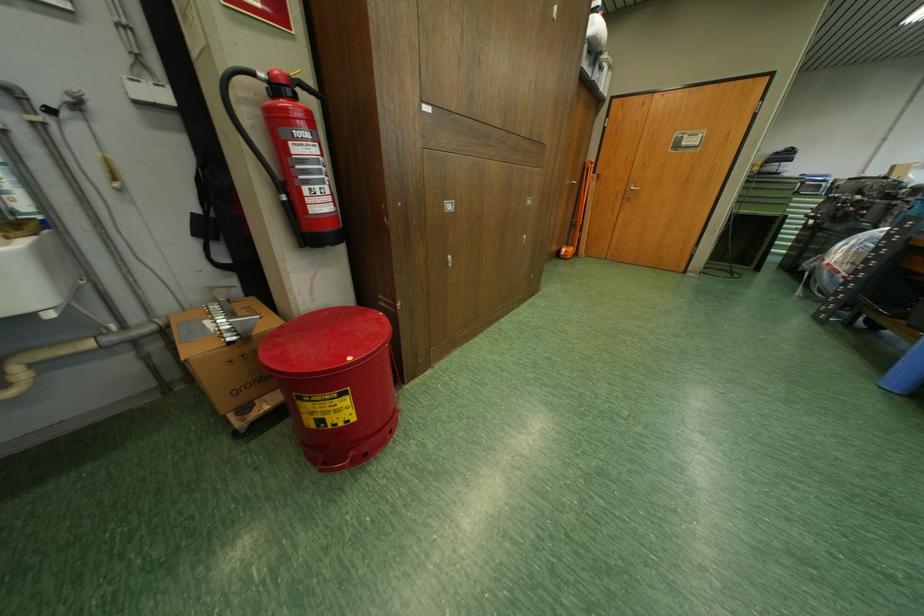
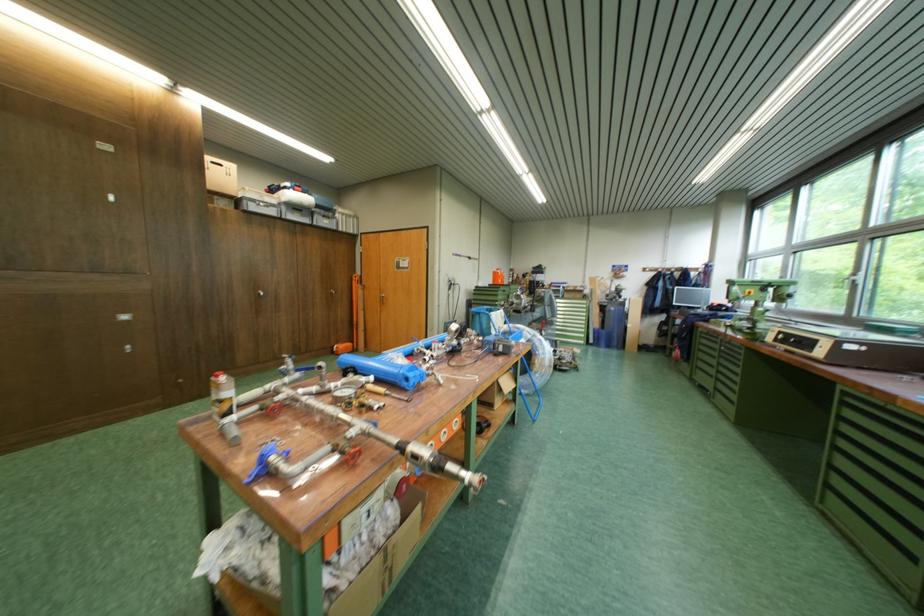
Question: What movement of the cameraman would produce the second image?

Choices:
 (A) Left
 (B) Right
 (C) Forward
 (D) Backward

Answer: (B)